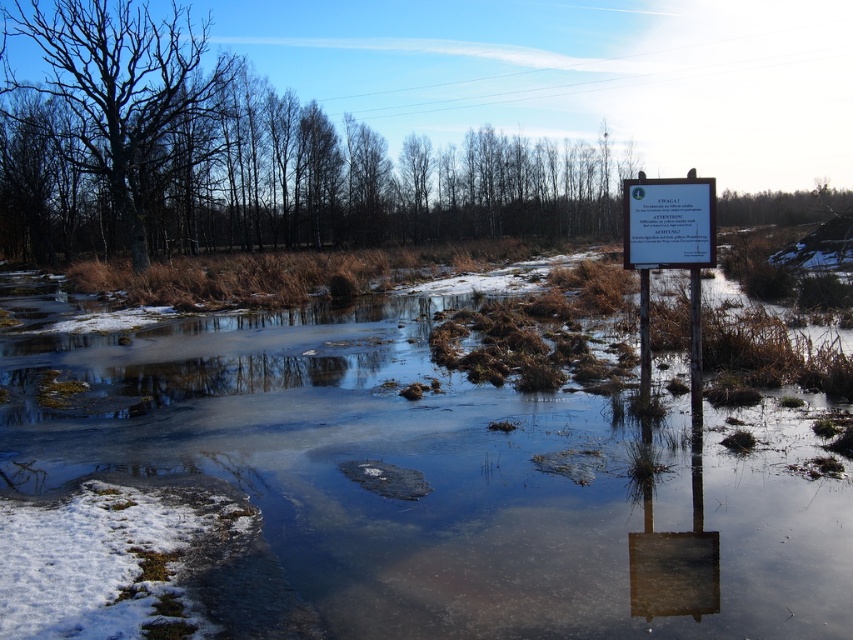
Between white plastic sign at center and bare wood tree at upper center, which one appears on the left side from the viewer's perspective?

From the viewer's perspective, white plastic sign at center appears more on the left side.

Between white plastic sign at center and bare wood tree at upper center, which one appears on the right side from the viewer's perspective?

Positioned to the right is bare wood tree at upper center.

Describe the element at coordinates (668, 221) in the screenshot. I see `white plastic sign at center` at that location.

You are a GUI agent. You are given a task and a screenshot of the screen. Output one action in this format:
    pyautogui.click(x=<x>, y=<y>)
    Task: Click on the white plastic sign at center
    This screenshot has width=853, height=640.
    Given the screenshot: What is the action you would take?
    pyautogui.click(x=668, y=221)

Describe the element at coordinates (245, 156) in the screenshot. I see `bare wood tree at upper left` at that location.

The image size is (853, 640). Describe the element at coordinates (245, 156) in the screenshot. I see `bare wood tree at upper left` at that location.

Locate an element on the screen. Image resolution: width=853 pixels, height=640 pixels. bare wood tree at upper left is located at coordinates (245, 156).

The width and height of the screenshot is (853, 640). What do you see at coordinates (122, 88) in the screenshot?
I see `dark brown bark tree at left` at bounding box center [122, 88].

Between dark brown bark tree at left and white plastic sign at right, which one is positioned higher?

dark brown bark tree at left

Does point (148, 128) lie in front of point (705, 256)?

No, it is behind (705, 256).

Identify the location of dark brown bark tree at left. (122, 88).